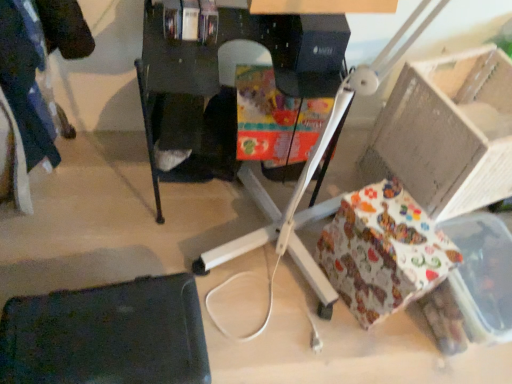
Question: Would you say black matte swivel chair at lower left is outside white cardboard box at right?

Choices:
 (A) no
 (B) yes

Answer: (B)

Question: Is black matte swivel chair at lower left wider than white cardboard box at right?

Choices:
 (A) yes
 (B) no

Answer: (B)

Question: Is black matte swivel chair at lower left not close to white cardboard box at right?

Choices:
 (A) no
 (B) yes

Answer: (A)

Question: Is black matte swivel chair at lower left at the right side of white cardboard box at right?

Choices:
 (A) yes
 (B) no

Answer: (B)

Question: Can you confirm if black matte swivel chair at lower left is shorter than white cardboard box at right?

Choices:
 (A) yes
 (B) no

Answer: (A)

Question: Is black matte swivel chair at lower left further to camera compared to white cardboard box at right?

Choices:
 (A) no
 (B) yes

Answer: (A)

Question: Is black matte swivel chair at lower left placed right next to black plastic desk at center?

Choices:
 (A) no
 (B) yes

Answer: (A)

Question: Can you confirm if black matte swivel chair at lower left is positioned to the right of black plastic desk at center?

Choices:
 (A) no
 (B) yes

Answer: (A)

Question: From a real-world perspective, is black matte swivel chair at lower left positioned over black plastic desk at center based on gravity?

Choices:
 (A) yes
 (B) no

Answer: (B)

Question: Could you tell me if black matte swivel chair at lower left is turned towards black plastic desk at center?

Choices:
 (A) yes
 (B) no

Answer: (B)

Question: Is black matte swivel chair at lower left positioned in front of black plastic desk at center?

Choices:
 (A) yes
 (B) no

Answer: (A)

Question: From the image's perspective, is black matte swivel chair at lower left over black plastic desk at center?

Choices:
 (A) yes
 (B) no

Answer: (B)

Question: Is black plastic desk at center turned away from patterned paper gift at lower right?

Choices:
 (A) no
 (B) yes

Answer: (A)